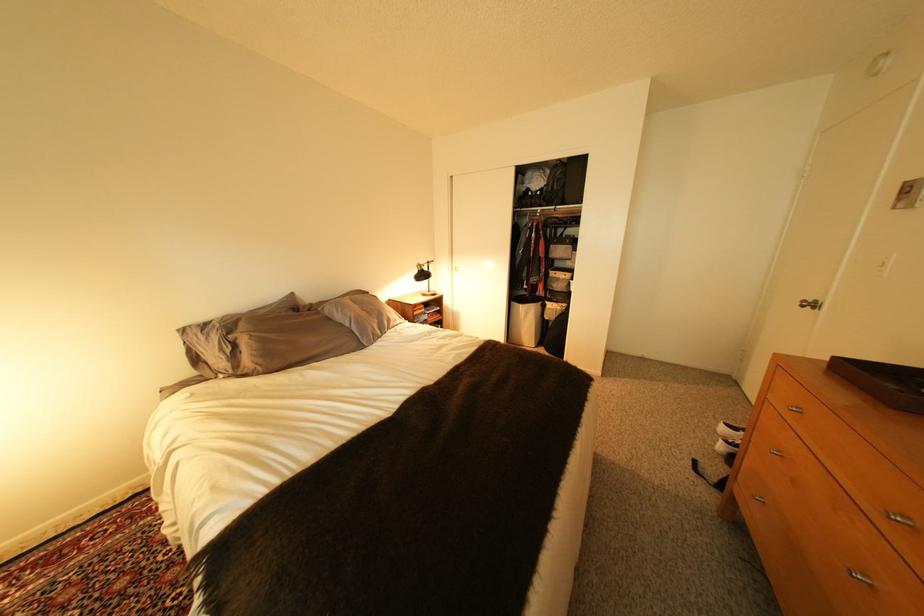
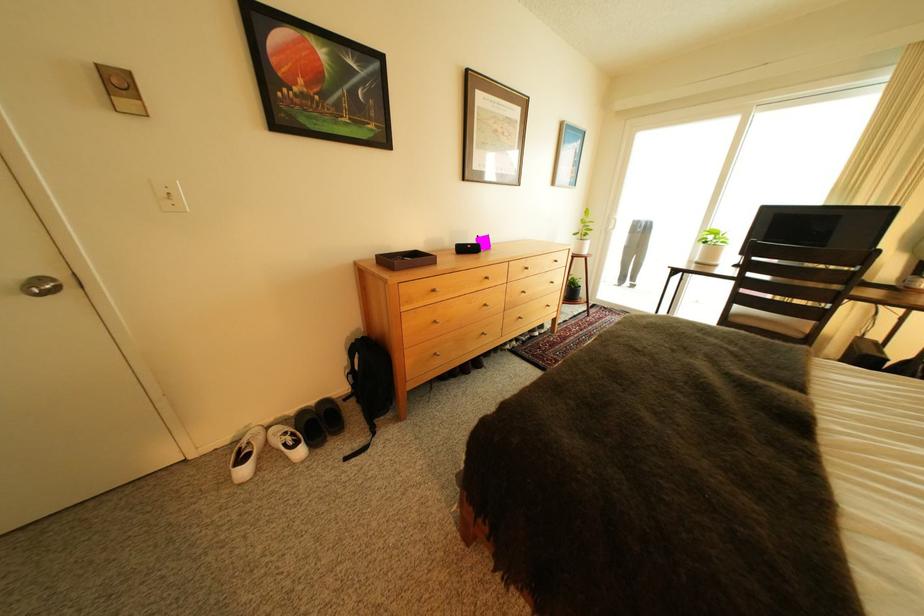
Locate, in the second image, the point that corresponds to point (829, 304) in the first image.

(55, 281)